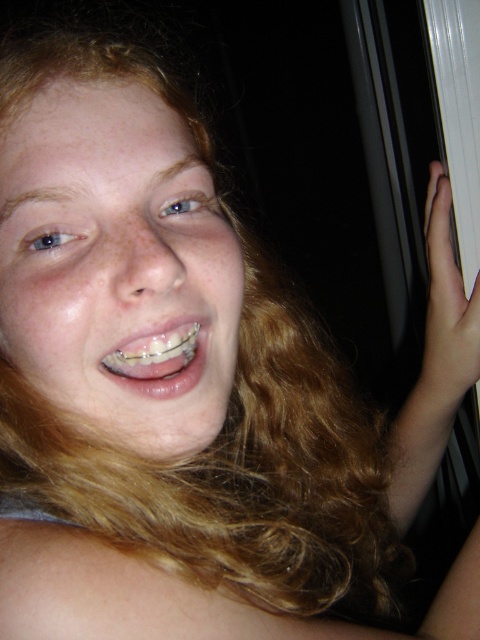
Is white matte hand at upper right further to the viewer compared to clear plastic braces at center?

Yes, white matte hand at upper right is further from the viewer.

Between white matte hand at upper right and clear plastic braces at center, which one has less height?

With less height is clear plastic braces at center.

Image resolution: width=480 pixels, height=640 pixels. In order to click on white matte hand at upper right in this screenshot , I will do `click(446, 301)`.